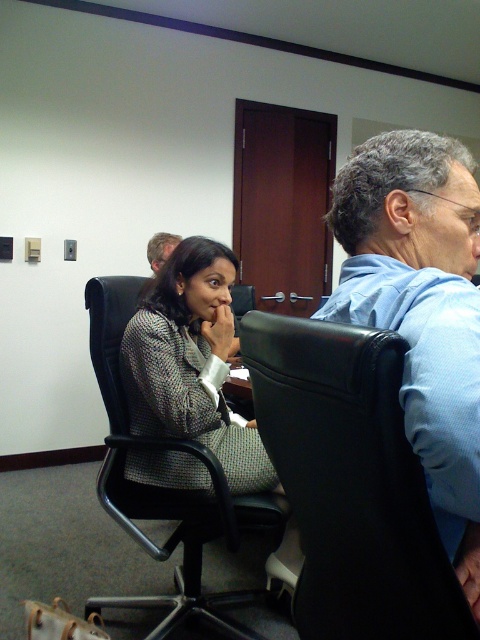
You are an interior designer assessing the office layout. You notice the patterned fabric jacket at center and the light brown hair at upper left. Which object has a greater width?

The patterned fabric jacket at center has a greater width than the light brown hair at upper left.

You are standing at the entrance of the room and want to move to the black leather swivel chair at right. Which direction should you head towards?

The black leather swivel chair at right is located at point [350,483], so you should head towards the right side of the room to reach it.